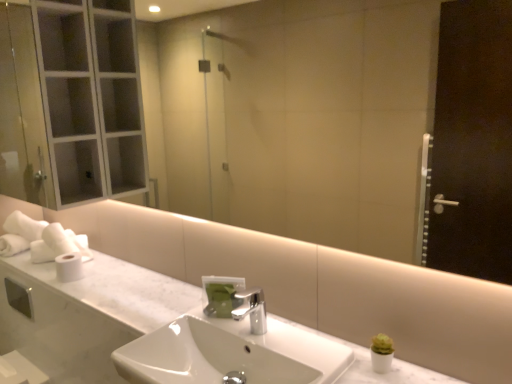
Identify the location of free space to the right of white matte toilet paper at left, which ranks as the second toilet paper in back-to-front order. (101, 275).